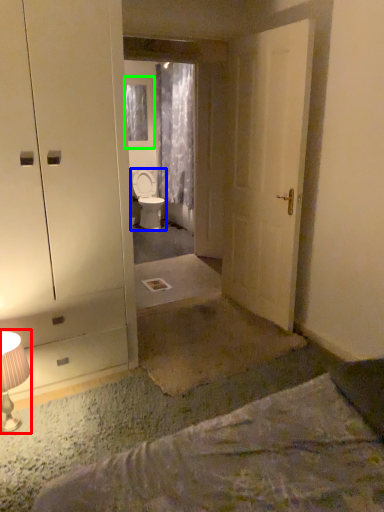
Question: Which object is positioned closest to table lamp (highlighted by a red box)? Select from toilet (highlighted by a blue box) and window (highlighted by a green box).

Choices:
 (A) toilet
 (B) window

Answer: (A)